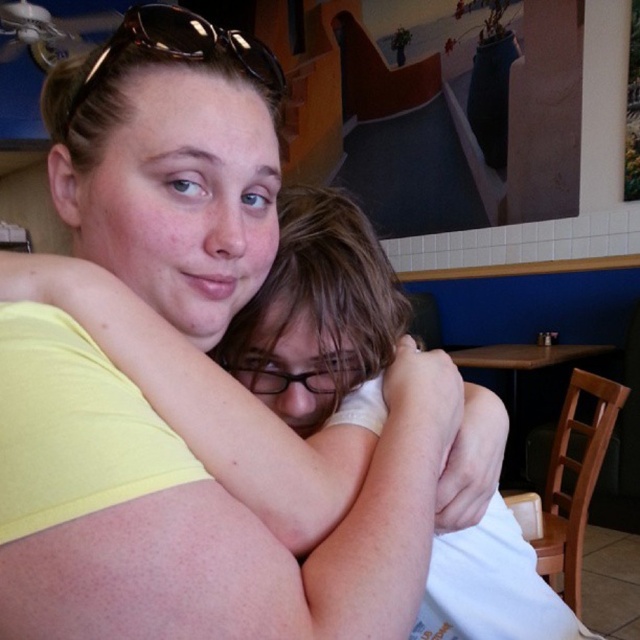
You are a photographer trying to capture the scene between the yellow matte shirt at center and the brown plastic sunglasses at upper center. Based on their positions, which object should you focus on first if you want to start from the left side of the image?

The brown plastic sunglasses at upper center should be focused on first since it is positioned to the left of the yellow matte shirt at center.

You are taking a photo of the scene and want to focus on both the point at coordinates point (13, 513) and point (230, 35). Since the camera can only focus on one depth at a time, which point should you choose to ensure at least one of them is in focus?

You should focus on point (13, 513) because it is closer to the camera than point (230, 35), so focusing on it increases the chance of that point being in focus.